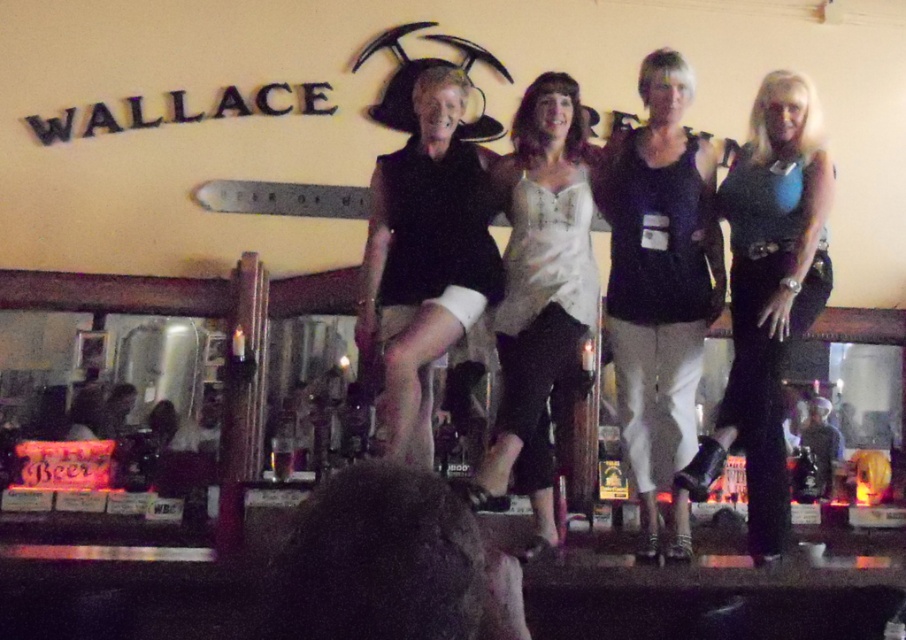
Who is positioned more to the left, shiny blue top at center or black matte vest at center?

From the viewer's perspective, black matte vest at center appears more on the left side.

Does shiny blue top at center have a greater height compared to black matte vest at center?

Yes, shiny blue top at center is taller than black matte vest at center.

At what (x,y) coordinates should I click in order to perform the action: click on shiny blue top at center. Please return your answer as a coordinate pair (x, y). This screenshot has height=640, width=906. Looking at the image, I should click on (769, 292).

At what (x,y) coordinates should I click in order to perform the action: click on shiny blue top at center. Please return your answer as a coordinate pair (x, y). The image size is (906, 640). Looking at the image, I should click on (769, 292).

From the picture: Who is more distant from viewer, (391, 240) or (545, 257)?

The point (391, 240) is more distant.

Does black matte vest at center appear on the right side of white lace blouse at center?

No, black matte vest at center is not to the right of white lace blouse at center.

Is point (382, 284) more distant than point (531, 248)?

That is True.

Find the location of a particular element. This screenshot has height=640, width=906. black matte vest at center is located at coordinates (423, 259).

Does shiny blue top at center have a greater height compared to dark brown leather jacket at center?

Correct, shiny blue top at center is much taller as dark brown leather jacket at center.

Is shiny blue top at center below dark brown leather jacket at center?

Actually, shiny blue top at center is above dark brown leather jacket at center.

Find the location of a particular element. This screenshot has width=906, height=640. shiny blue top at center is located at coordinates (769, 292).